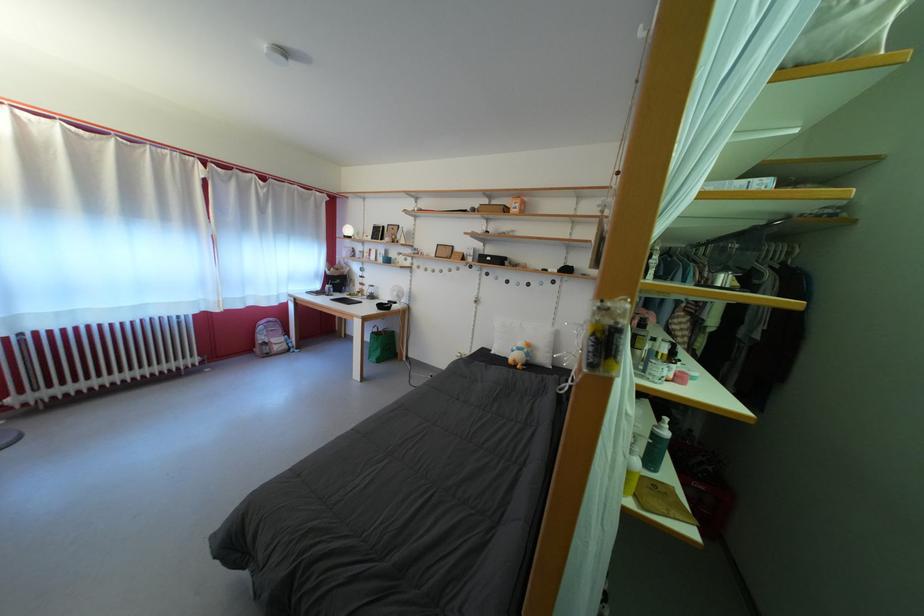
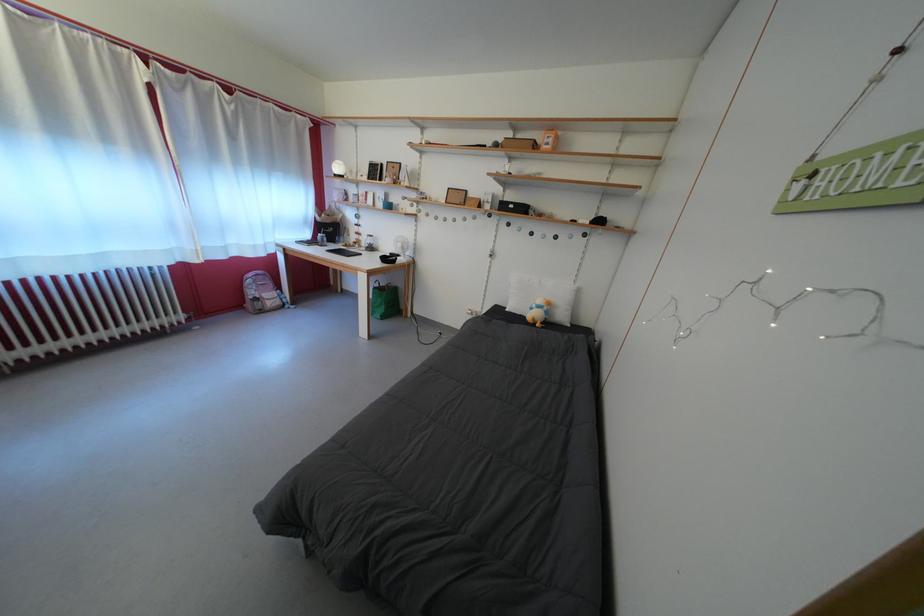
Find the pixel in the second image that matches [370,293] in the first image.

(365, 243)